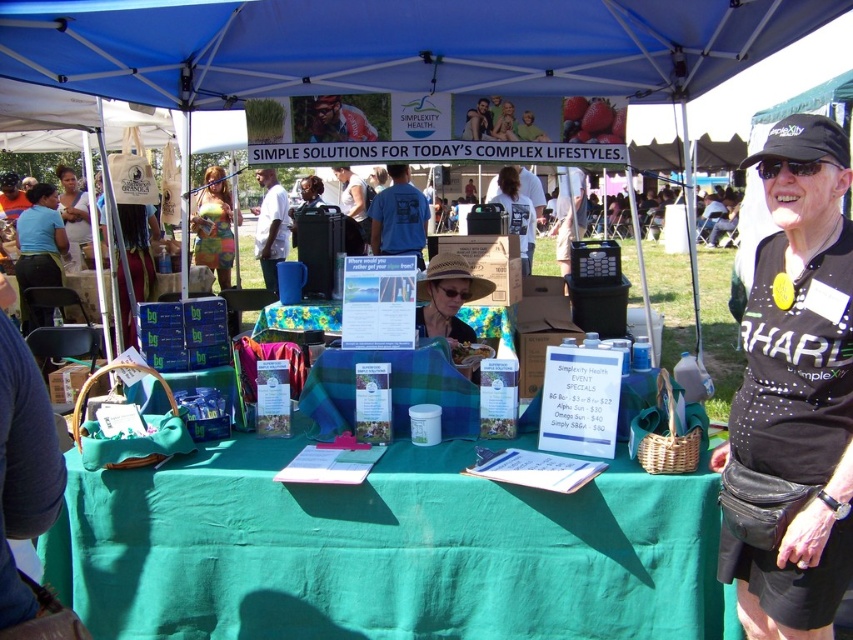
You are organizing a health fair booth and need to place a matte white tote bag at upper left and a matte black laptop at center on the table. The table has limited space. Which item should you place first to ensure both fit properly?

You should place the matte black laptop at center first because the matte white tote bag at upper left might be wider than the matte black laptop at center, so placing the wider item first ensures proper spacing.

You are a visitor at the event and want to pick up a brochure from the basket. The basket is on the table. To reach it, you need to move around either the matte blue shirt at left or the floral fabric tablecloth at center. Which object do you need to move around?

The floral fabric tablecloth at center is behind the matte blue shirt at left, so you need to move around the matte blue shirt at left to access the basket on the table.